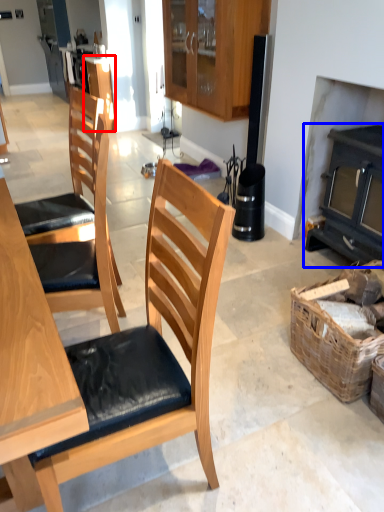
Question: Which object appears closest to the camera in this image, cabinetry (highlighted by a red box) or fireplace (highlighted by a blue box)?

Choices:
 (A) cabinetry
 (B) fireplace

Answer: (B)